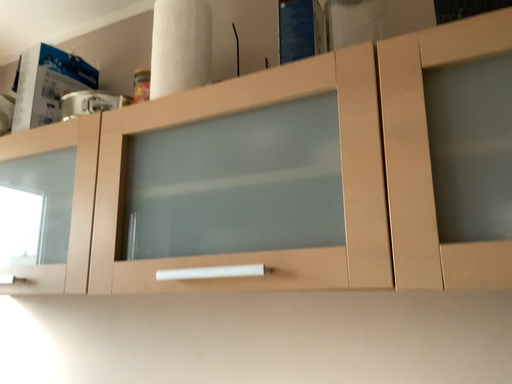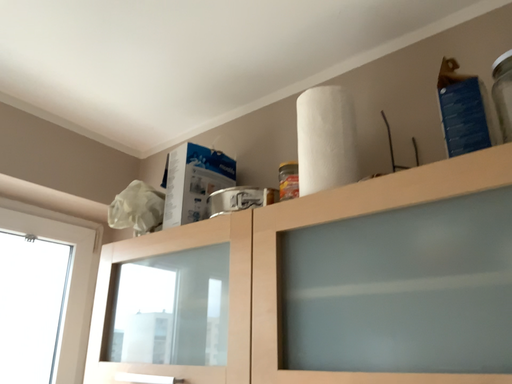
Question: How did the camera likely rotate when shooting the video?

Choices:
 (A) rotated upward
 (B) rotated downward

Answer: (A)